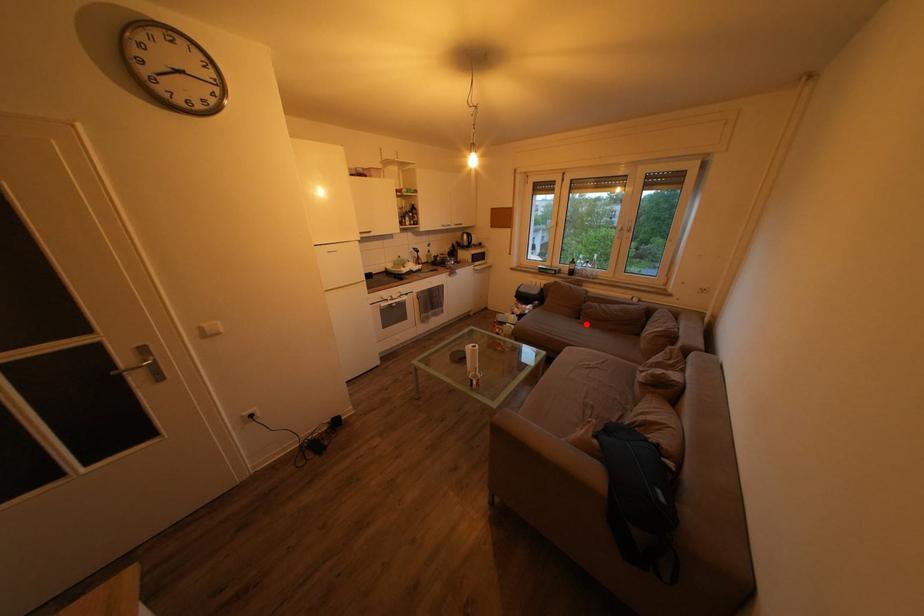
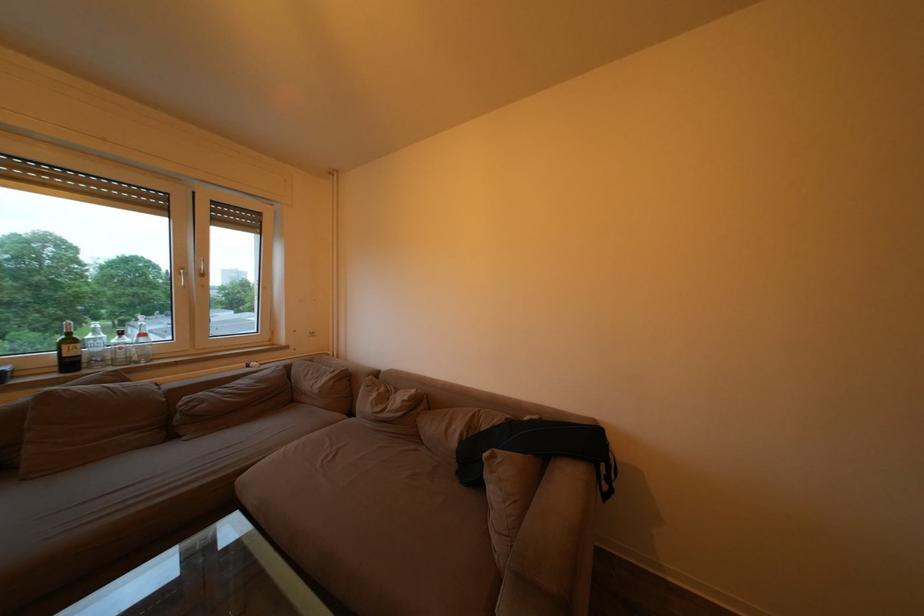
The point at the highlighted location is marked in the first image. Where is the corresponding point in the second image?

(178, 443)